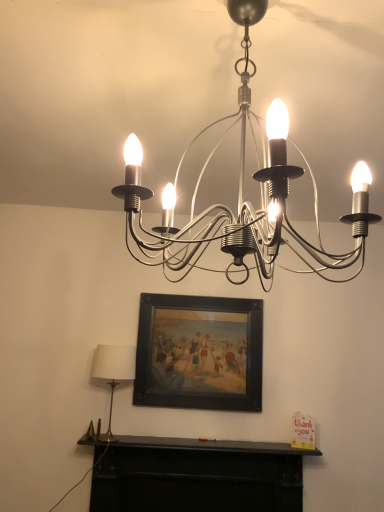
Question: From a real-world perspective, is black matte fireplace at lower center on satin silver chandelier at upper center, which is counted as the 2th lamp, starting from the left?

Choices:
 (A) no
 (B) yes

Answer: (A)

Question: Can you confirm if black matte fireplace at lower center is taller than satin silver chandelier at upper center, which is counted as the 2th lamp, starting from the left?

Choices:
 (A) no
 (B) yes

Answer: (A)

Question: Is black matte fireplace at lower center outside of satin silver chandelier at upper center, acting as the second lamp starting from the back?

Choices:
 (A) yes
 (B) no

Answer: (A)

Question: Is satin silver chandelier at upper center, arranged as the first lamp when viewed from the front, a part of black matte fireplace at lower center?

Choices:
 (A) yes
 (B) no

Answer: (B)

Question: Can you confirm if black matte fireplace at lower center is smaller than satin silver chandelier at upper center, placed as the 1th lamp when sorted from top to bottom?

Choices:
 (A) no
 (B) yes

Answer: (B)

Question: Considering the positions of black matte fireplace at lower center and satin silver chandelier at upper center, arranged as the first lamp when viewed from the front, in the image, is black matte fireplace at lower center wider or thinner than satin silver chandelier at upper center, arranged as the first lamp when viewed from the front,?

Choices:
 (A) thin
 (B) wide

Answer: (A)

Question: From a real-world perspective, is black matte fireplace at lower center positioned above or below satin silver chandelier at upper center, placed as the 1th lamp when sorted from top to bottom?

Choices:
 (A) above
 (B) below

Answer: (B)

Question: In the image, is black matte fireplace at lower center positioned in front of or behind satin silver chandelier at upper center, marked as the 1th lamp in a right-to-left arrangement?

Choices:
 (A) front
 (B) behind

Answer: (B)

Question: Based on their sizes in the image, would you say black matte fireplace at lower center is bigger or smaller than satin silver chandelier at upper center, arranged as the first lamp when viewed from the front?

Choices:
 (A) big
 (B) small

Answer: (B)

Question: From a real-world perspective, is white fabric lampshade at left, acting as the 2th lamp starting from the front, physically located above or below black matte fireplace at lower center?

Choices:
 (A) below
 (B) above

Answer: (B)

Question: Based on their sizes in the image, would you say white fabric lampshade at left, the first lamp viewed from the left, is bigger or smaller than black matte fireplace at lower center?

Choices:
 (A) small
 (B) big

Answer: (A)

Question: Choose the correct answer: Is white fabric lampshade at left, arranged as the second lamp when viewed from the top, inside black matte fireplace at lower center or outside it?

Choices:
 (A) outside
 (B) inside

Answer: (A)

Question: Is white fabric lampshade at left, the 1th lamp viewed from the back, to the left or to the right of black matte fireplace at lower center in the image?

Choices:
 (A) left
 (B) right

Answer: (A)

Question: Considering their positions, is satin silver chandelier at upper center, placed as the 1th lamp when sorted from top to bottom, located in front of or behind black matte fireplace at lower center?

Choices:
 (A) front
 (B) behind

Answer: (A)

Question: Is satin silver chandelier at upper center, acting as the second lamp starting from the back, inside or outside of black matte fireplace at lower center?

Choices:
 (A) outside
 (B) inside

Answer: (A)